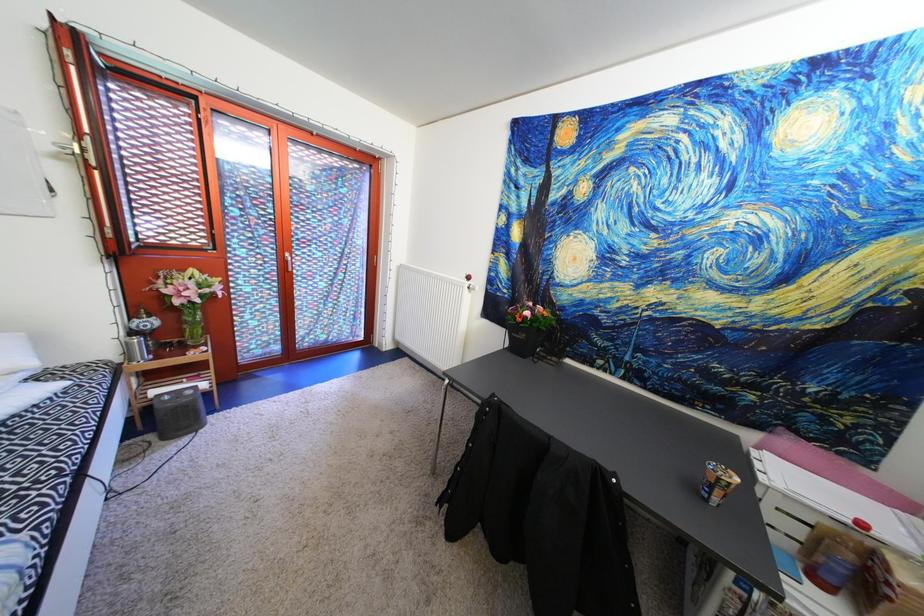
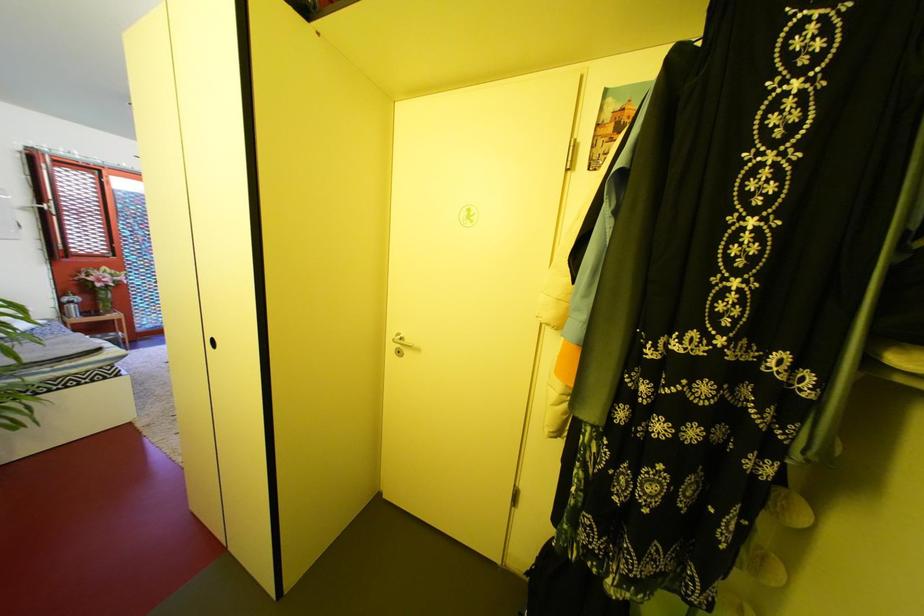
The images are taken continuously from a first-person perspective. In which direction are you moving?

The cameraman moved toward right, backward.